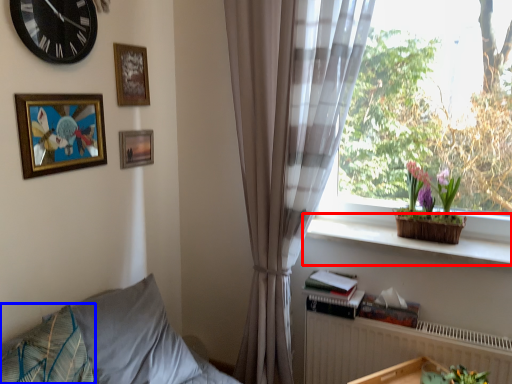
Question: Which object is closer to the camera taking this photo, window sill (highlighted by a red box) or pillow (highlighted by a blue box)?

Choices:
 (A) window sill
 (B) pillow

Answer: (B)